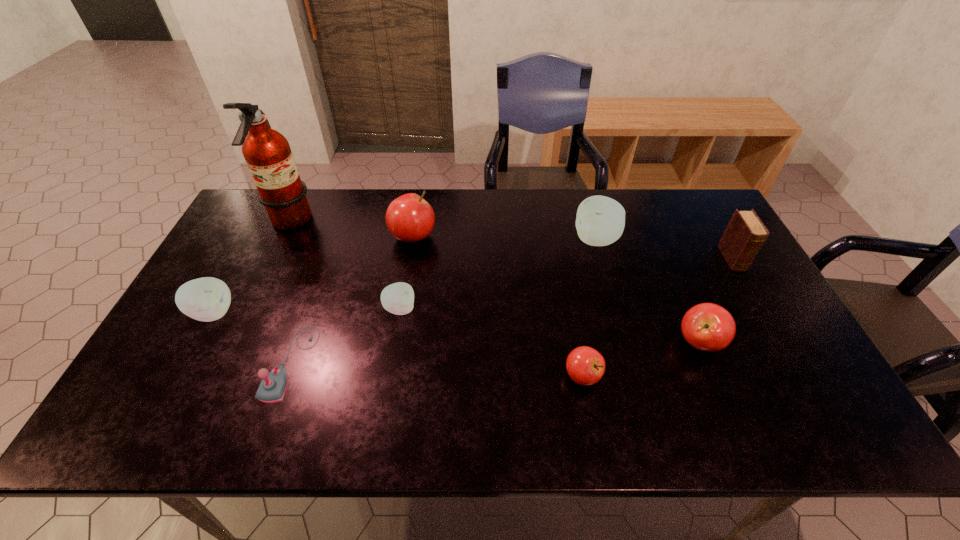
Where is `the eighth object from left to right`? This screenshot has width=960, height=540. the eighth object from left to right is located at coordinates (709, 327).

What are the coordinates of `the second white apple from right to left` in the screenshot? It's located at (398, 298).

The width and height of the screenshot is (960, 540). Find the location of `the fourth apple from left to right`. the fourth apple from left to right is located at coordinates (585, 365).

Image resolution: width=960 pixels, height=540 pixels. I want to click on the second red apple from right to left, so click(585, 365).

I want to click on joystick, so pos(272,388).

Where is `the seventh object from right to left`? This screenshot has width=960, height=540. the seventh object from right to left is located at coordinates (272, 388).

Locate an element on the screen. The width and height of the screenshot is (960, 540). free spot located 0.290m on the nozzle and handle of the fire extinguisher is located at coordinates (399, 222).

Identify the location of free spot located on the right of the farthest white apple. This screenshot has width=960, height=540. (675, 240).

At what (x,y) coordinates should I click in order to perform the action: click on blank area located on the left of the biggest red apple. Please return your answer as a coordinate pair (x, y). This screenshot has height=540, width=960. Looking at the image, I should click on [305, 237].

Where is `vacant space located on the spine side of the brown diary`? This screenshot has height=540, width=960. vacant space located on the spine side of the brown diary is located at coordinates pos(755,296).